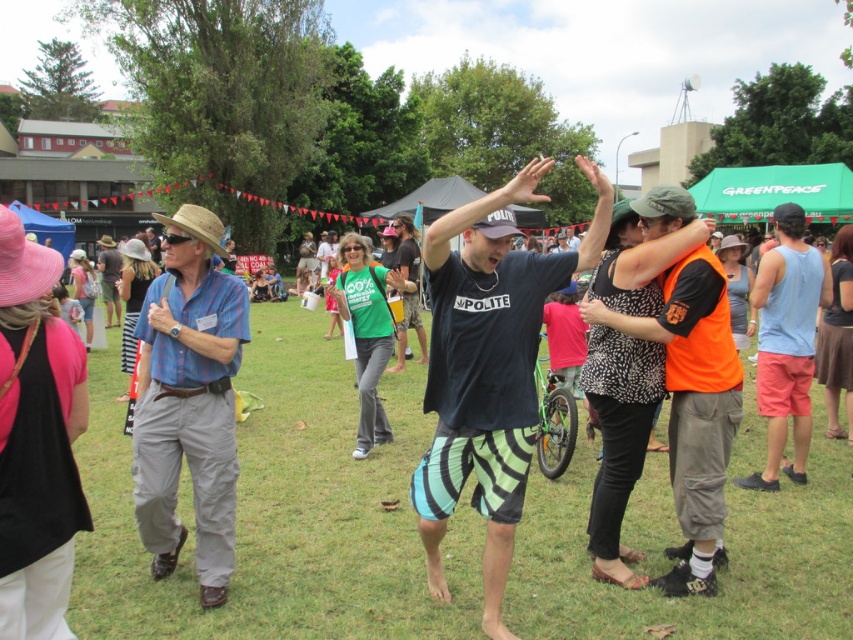
Based on the scene described, which object is narrower between the orange reflective vest at center and the light blue tank top at right?

The orange reflective vest at center is narrower than the light blue tank top at right.